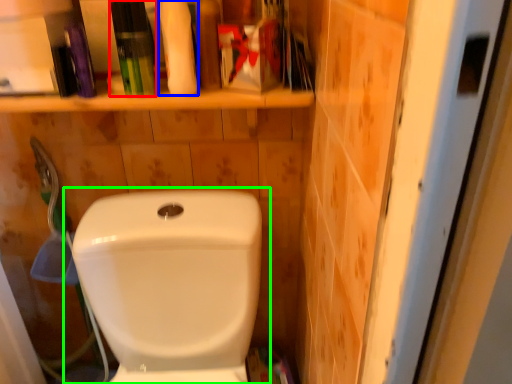
Question: Estimate the real-world distances between objects in this image. Which object is farther from toiletry (highlighted by a red box), cleaning product (highlighted by a blue box) or toilet (highlighted by a green box)?

Choices:
 (A) cleaning product
 (B) toilet

Answer: (B)